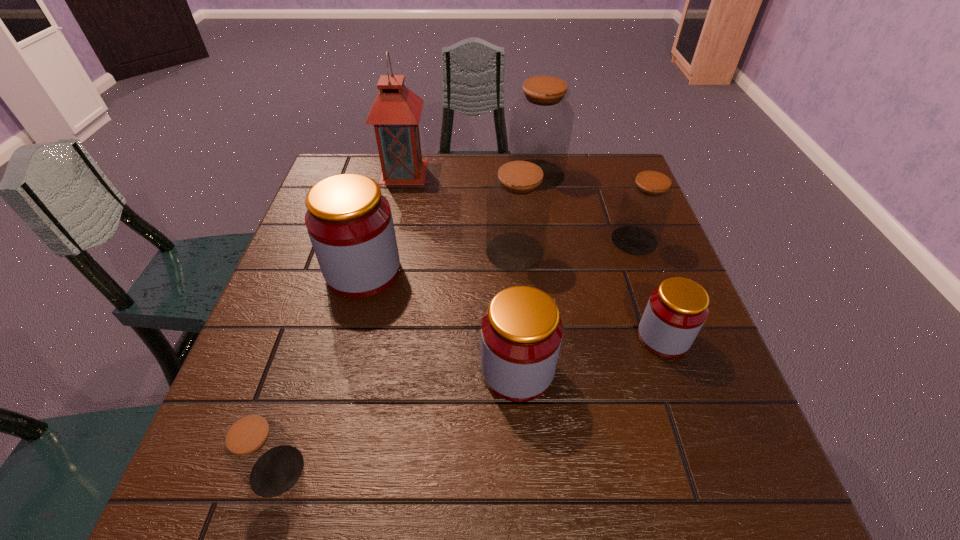
The width and height of the screenshot is (960, 540). I want to click on pink lantern, so click(x=395, y=113).

This screenshot has width=960, height=540. What are the coordinates of `lantern` in the screenshot? It's located at (395, 113).

I want to click on the tallest jar, so click(541, 121).

In order to click on the biggest brown jar in this screenshot , I will do `click(541, 121)`.

Image resolution: width=960 pixels, height=540 pixels. Find the location of `the third smallest brown jar`. the third smallest brown jar is located at coordinates (518, 204).

This screenshot has width=960, height=540. Find the location of `the farthest red jar`. the farthest red jar is located at coordinates (349, 222).

Where is `the leftmost red jar`? This screenshot has width=960, height=540. the leftmost red jar is located at coordinates (349, 222).

At what (x,y) coordinates should I click in order to perform the action: click on the rightmost brown jar. Please return your answer as a coordinate pair (x, y). The width and height of the screenshot is (960, 540). Looking at the image, I should click on (645, 205).

The height and width of the screenshot is (540, 960). I want to click on the second biggest red jar, so [521, 333].

The width and height of the screenshot is (960, 540). I want to click on the smallest red jar, so click(676, 311).